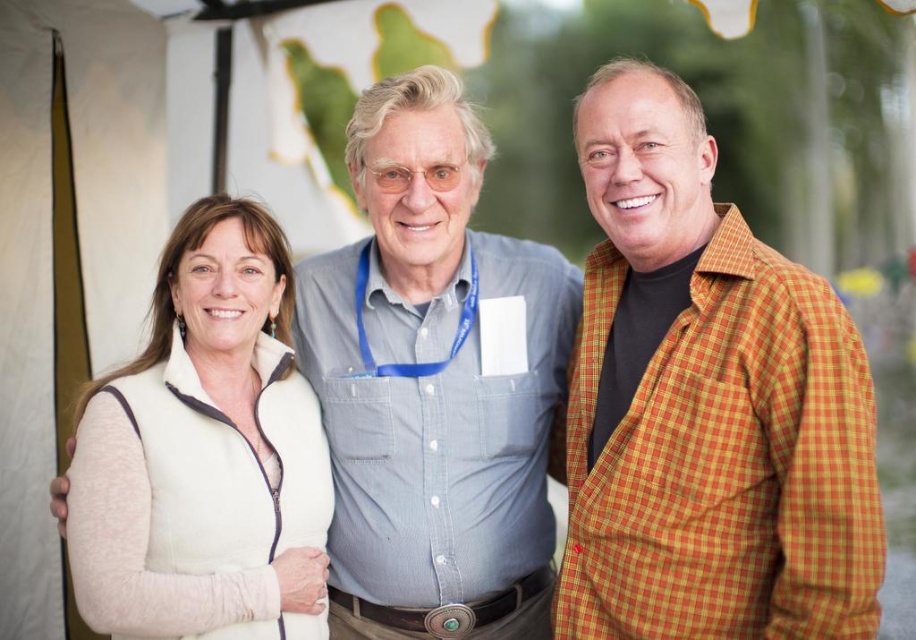
You are a photographer setting up for a group photo. You need to ensure that the orange checkered jacket at right and the white fleece vest at left are both visible in the frame. Based on their heights, which of these two items might require you to adjust your camera angle to avoid being cut off?

The orange checkered jacket at right is much taller than the white fleece vest at left, so it might require adjusting the camera angle to avoid being cut off due to its greater height.